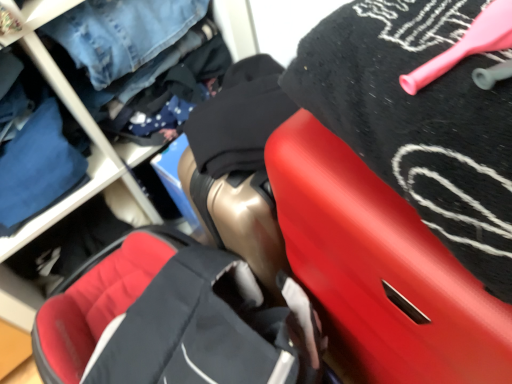
Question: Does blue denim jeans at upper left, the first clothing positioned from the left, turn towards soft fabric baby carriage at center?

Choices:
 (A) yes
 (B) no

Answer: (B)

Question: From a real-world perspective, is blue denim jeans at upper left, which is the 2th clothing from right to left, positioned under soft fabric baby carriage at center based on gravity?

Choices:
 (A) no
 (B) yes

Answer: (A)

Question: Can we say blue denim jeans at upper left, which is the 2th clothing from right to left, lies outside soft fabric baby carriage at center?

Choices:
 (A) no
 (B) yes

Answer: (B)

Question: Is the depth of blue denim jeans at upper left, which is the 2th clothing from right to left, less than that of soft fabric baby carriage at center?

Choices:
 (A) no
 (B) yes

Answer: (A)

Question: Does blue denim jeans at upper left, which is the 2th clothing from right to left, appear on the left side of soft fabric baby carriage at center?

Choices:
 (A) no
 (B) yes

Answer: (B)

Question: Is blue denim jeans at upper left, the first clothing positioned from the left, thinner than soft fabric baby carriage at center?

Choices:
 (A) no
 (B) yes

Answer: (B)

Question: From the image's perspective, would you say blue denim jeans at upper left, which ranks as the 1th clothing in back-to-front order, is positioned over rubberized red suitcase at upper right?

Choices:
 (A) yes
 (B) no

Answer: (A)

Question: Can you confirm if blue denim jeans at upper left, the second clothing in the front-to-back sequence, is taller than rubberized red suitcase at upper right?

Choices:
 (A) no
 (B) yes

Answer: (A)

Question: Is blue denim jeans at upper left, which is the 2th clothing from right to left, bigger than rubberized red suitcase at upper right?

Choices:
 (A) yes
 (B) no

Answer: (B)

Question: Is blue denim jeans at upper left, which is the 2th clothing from right to left, behind rubberized red suitcase at upper right?

Choices:
 (A) yes
 (B) no

Answer: (A)

Question: From a real-world perspective, is blue denim jeans at upper left, the first clothing positioned from the left, physically above rubberized red suitcase at upper right?

Choices:
 (A) yes
 (B) no

Answer: (A)

Question: Considering the relative sizes of blue denim jeans at upper left, the second clothing in the front-to-back sequence, and rubberized red suitcase at upper right in the image provided, is blue denim jeans at upper left, the second clothing in the front-to-back sequence, shorter than rubberized red suitcase at upper right?

Choices:
 (A) no
 (B) yes

Answer: (B)

Question: Does rubberized red suitcase at upper right have a greater height compared to blue denim jeans at upper left, which ranks as the 1th clothing in back-to-front order?

Choices:
 (A) yes
 (B) no

Answer: (A)